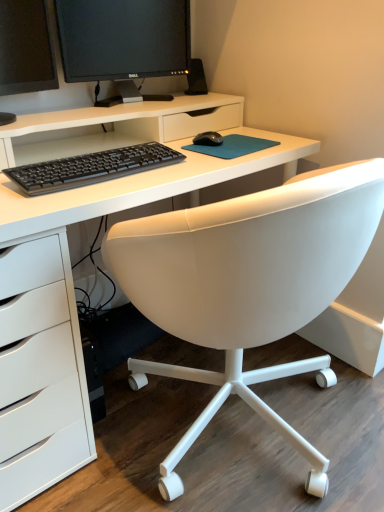
Question: Is black glossy monitor at upper left, arranged as the second computer monitor when viewed from the right, completely or partially inside black plastic speaker at upper center?

Choices:
 (A) yes
 (B) no

Answer: (B)

Question: Is black plastic speaker at upper center smaller than black glossy monitor at upper left, arranged as the second computer monitor when viewed from the right?

Choices:
 (A) yes
 (B) no

Answer: (A)

Question: From a real-world perspective, is black plastic speaker at upper center below black glossy monitor at upper left, placed as the first computer monitor when sorted from left to right?

Choices:
 (A) yes
 (B) no

Answer: (A)

Question: Considering the relative positions of black plastic speaker at upper center and black glossy monitor at upper left, arranged as the second computer monitor when viewed from the right, in the image provided, is black plastic speaker at upper center behind black glossy monitor at upper left, arranged as the second computer monitor when viewed from the right,?

Choices:
 (A) no
 (B) yes

Answer: (B)

Question: Is black plastic speaker at upper center wider than black glossy monitor at upper left, arranged as the second computer monitor when viewed from the right?

Choices:
 (A) no
 (B) yes

Answer: (A)

Question: Is point (43, 33) closer or farther from the camera than point (211, 131)?

Choices:
 (A) closer
 (B) farther

Answer: (A)

Question: Which is correct: black glossy monitor at upper left, arranged as the second computer monitor when viewed from the right, is inside black matte mouse at center, or outside of it?

Choices:
 (A) outside
 (B) inside

Answer: (A)

Question: From the image's perspective, is black glossy monitor at upper left, placed as the first computer monitor when sorted from left to right, located above or below black matte mouse at center?

Choices:
 (A) above
 (B) below

Answer: (A)

Question: Considering the positions of black glossy monitor at upper left, placed as the first computer monitor when sorted from left to right, and black matte mouse at center in the image, is black glossy monitor at upper left, placed as the first computer monitor when sorted from left to right, wider or thinner than black matte mouse at center?

Choices:
 (A) thin
 (B) wide

Answer: (B)

Question: Relative to black plastic speaker at upper center, is black matte mouse at center in front or behind?

Choices:
 (A) behind
 (B) front

Answer: (B)

Question: Looking at the image, does black matte mouse at center seem bigger or smaller compared to black plastic speaker at upper center?

Choices:
 (A) small
 (B) big

Answer: (A)

Question: From the image's perspective, is black matte mouse at center located above or below black plastic speaker at upper center?

Choices:
 (A) below
 (B) above

Answer: (A)

Question: Is black matte mouse at center situated inside black plastic speaker at upper center or outside?

Choices:
 (A) outside
 (B) inside

Answer: (A)

Question: From a real-world perspective, relative to black matte mouse at center, is black matte keyboard at center vertically above or below?

Choices:
 (A) above
 (B) below

Answer: (B)

Question: Is black matte keyboard at center inside the boundaries of black matte mouse at center, or outside?

Choices:
 (A) outside
 (B) inside

Answer: (A)